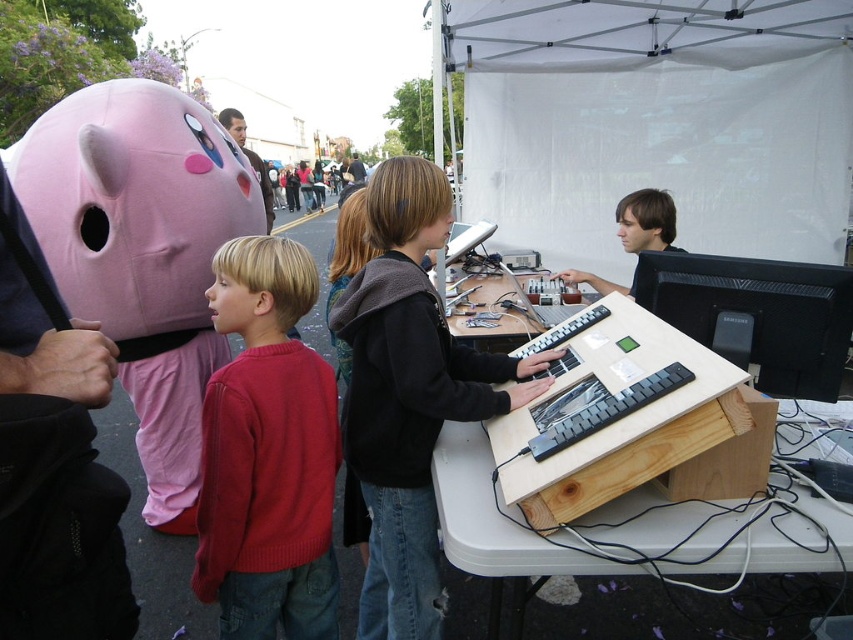
Which is more to the right, wooden at lower right or black plastic keyboard at center?

black plastic keyboard at center

Can you confirm if wooden at lower right is bigger than black plastic keyboard at center?

Indeed, wooden at lower right has a larger size compared to black plastic keyboard at center.

Which is in front, point (532, 531) or point (612, 394)?

Positioned in front is point (532, 531).

This screenshot has width=853, height=640. Find the location of `wooden at lower right`. wooden at lower right is located at coordinates (639, 554).

Who is higher up, black matte monitor at center or black plastic keyboard at center?

black matte monitor at center is higher up.

Find the location of a particular element. The width and height of the screenshot is (853, 640). black matte monitor at center is located at coordinates (758, 314).

Identify the location of black matte monitor at center. This screenshot has width=853, height=640. (758, 314).

Between point (190, 179) and point (583, 429), which one is positioned in front?

Point (583, 429)

Can you confirm if pink fabric mask at left is smaller than black plastic keyboard at center?

No.

At what (x,y) coordinates should I click in order to perform the action: click on pink fabric mask at left. Please return your answer as a coordinate pair (x, y). The image size is (853, 640). Looking at the image, I should click on (142, 252).

The width and height of the screenshot is (853, 640). What are the coordinates of `pink fabric mask at left` in the screenshot? It's located at (142, 252).